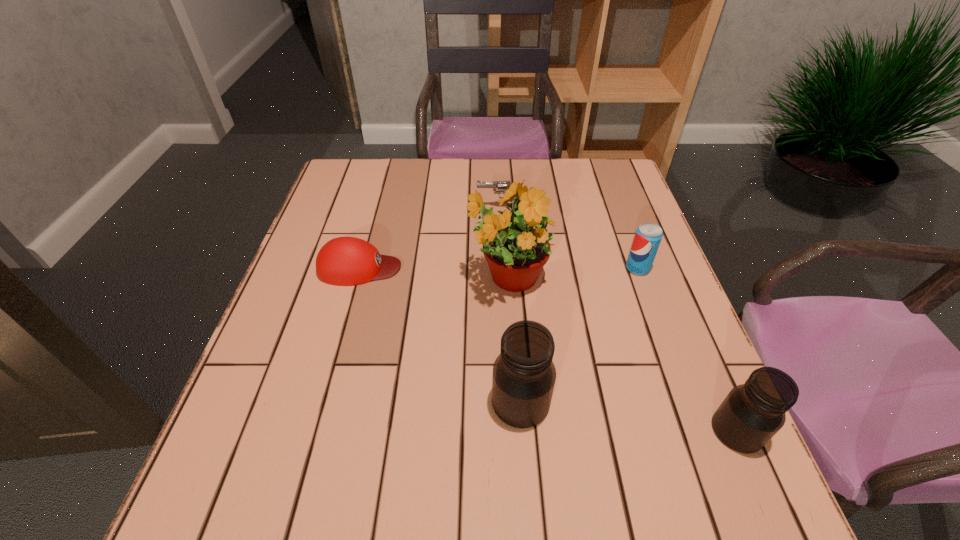
Find the location of `the left jar`. the left jar is located at coordinates (524, 375).

You are a GUI agent. You are given a task and a screenshot of the screen. Output one action in this format:
    pyautogui.click(x=<x>, y=<y>)
    Task: Click on the fifth shortest object
    The image size is (960, 540).
    Given the screenshot: What is the action you would take?
    pyautogui.click(x=524, y=375)

In order to click on the third tallest object in this screenshot , I will do `click(751, 414)`.

You are a GUI agent. You are given a task and a screenshot of the screen. Output one action in this format:
    pyautogui.click(x=<x>, y=<y>)
    Task: Click on the right jar
    
    Given the screenshot: What is the action you would take?
    pyautogui.click(x=751, y=414)

Find the location of a particular element. The width and height of the screenshot is (960, 540). pistol is located at coordinates (501, 185).

The width and height of the screenshot is (960, 540). Identify the location of the leftmost object. (346, 261).

Find the location of `the third shortest object`. the third shortest object is located at coordinates (648, 236).

The width and height of the screenshot is (960, 540). Find the location of `flowerpot`. flowerpot is located at coordinates (515, 241).

The width and height of the screenshot is (960, 540). I want to click on free spot located 0.380m on the back of the fifth shortest object, so click(510, 247).

I want to click on free location located on the left of the right jar, so click(x=514, y=430).